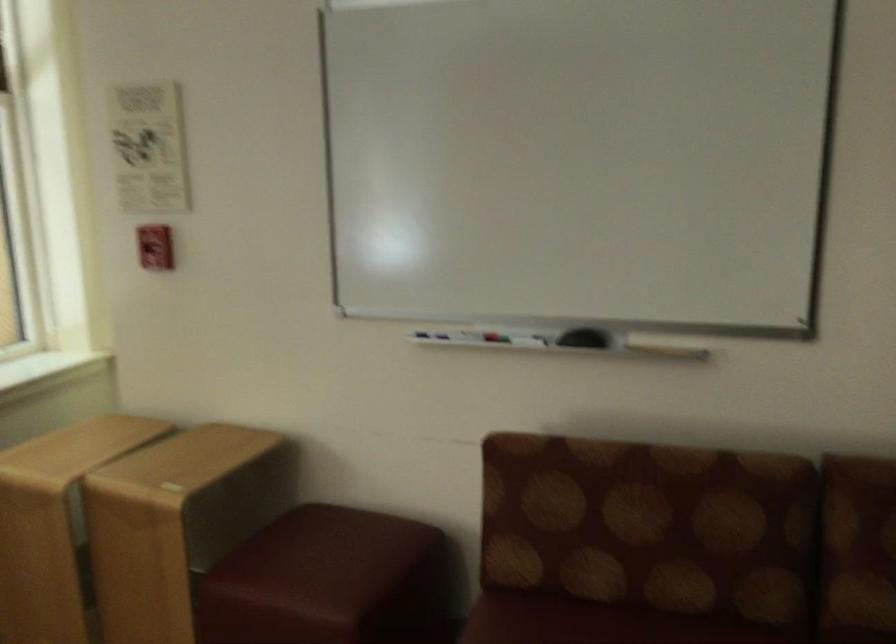
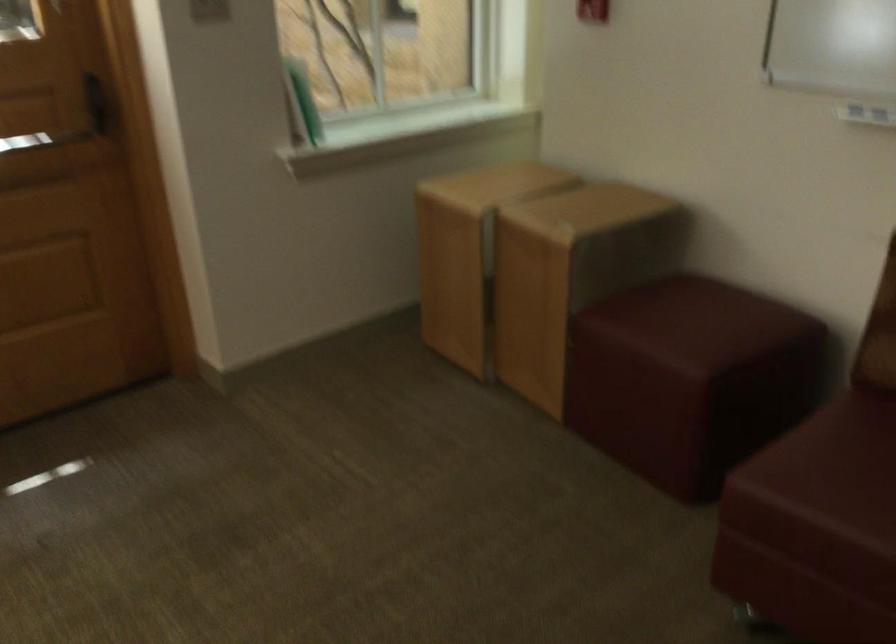
Where in the second image is the point corresponding to the point at 184,540 from the first image?

(570, 272)